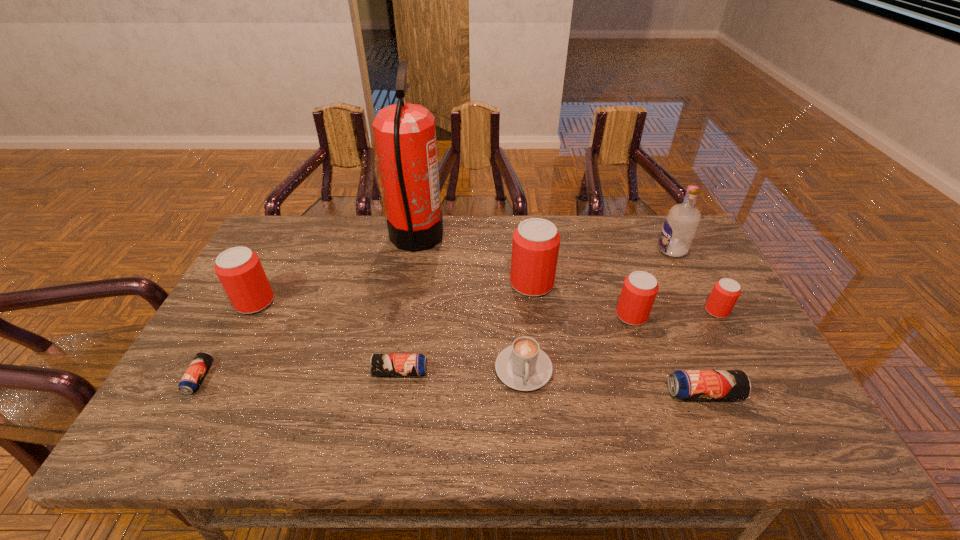
Locate an element on the screen. The height and width of the screenshot is (540, 960). the rightmost red beer can is located at coordinates (725, 293).

The height and width of the screenshot is (540, 960). Identify the location of the seventh tallest object. click(x=523, y=366).

Where is `the biggest blue beer can`? the biggest blue beer can is located at coordinates (684, 384).

Locate an element on the screen. the rightmost blue beer can is located at coordinates (684, 384).

The width and height of the screenshot is (960, 540). What are the coordinates of `the second blue beer can from right to left` in the screenshot? It's located at (380, 364).

At what (x,y) coordinates should I click in order to perform the action: click on the ninth tallest object. Please return your answer as a coordinate pair (x, y). This screenshot has height=540, width=960. Looking at the image, I should click on (380, 364).

I want to click on the shortest beer can, so click(x=189, y=383).

Locate an element on the screen. The height and width of the screenshot is (540, 960). the leftmost blue beer can is located at coordinates (189, 383).

Locate an element on the screen. The height and width of the screenshot is (540, 960). free spot located on the front side of the fire extinguisher is located at coordinates (536, 239).

The image size is (960, 540). In order to click on vacant space situated on the label of the vodka in this screenshot , I will do `click(570, 250)`.